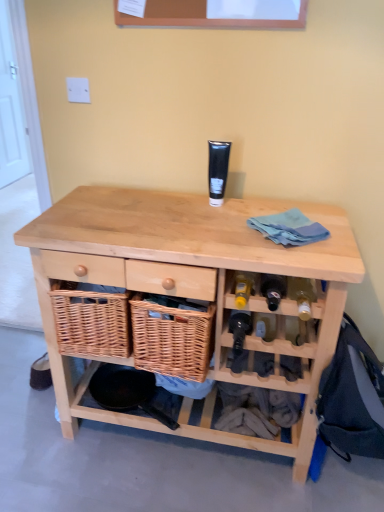
Find the location of a particular element. This screenshot has width=384, height=512. free space to the right of black matte tube at center is located at coordinates (263, 204).